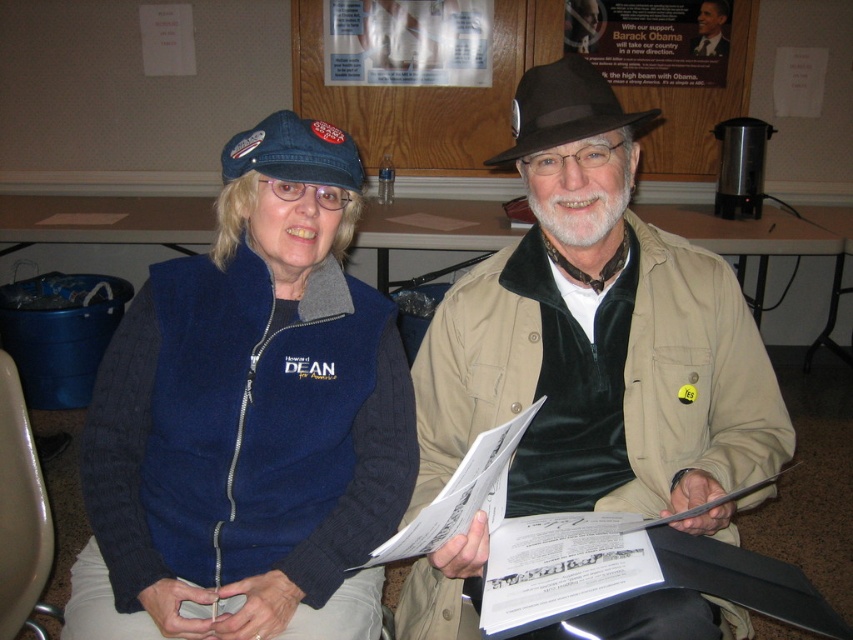
Question: Which point is farther to the camera?

Choices:
 (A) (572, 96)
 (B) (99, 634)
 (C) (300, 518)

Answer: (C)

Question: Is corduroy fabric pants at lower center to the right of brown felt hat at center from the viewer's perspective?

Choices:
 (A) no
 (B) yes

Answer: (A)

Question: Which point is closer to the camera taking this photo?

Choices:
 (A) (337, 134)
 (B) (589, 166)
 (C) (74, 621)
 (D) (519, 125)

Answer: (B)

Question: Is blue fleece vest at center wider than beige fabric jacket at center?

Choices:
 (A) yes
 (B) no

Answer: (B)

Question: Is blue fleece vest at center positioned before brown felt hat at center?

Choices:
 (A) no
 (B) yes

Answer: (A)

Question: Among these points, which one is farthest from the camera?

Choices:
 (A) (422, 401)
 (B) (271, 113)

Answer: (B)